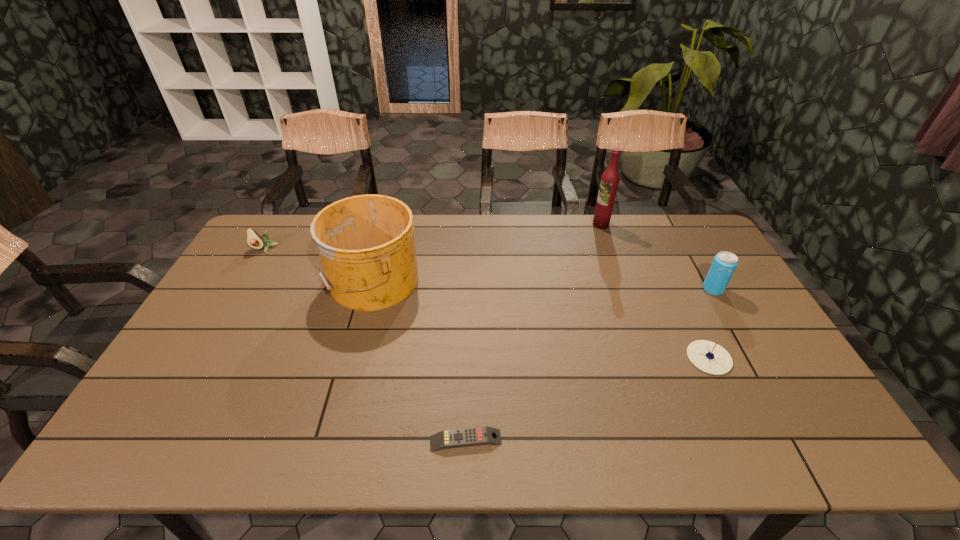
You are a GUI agent. You are given a task and a screenshot of the screen. Output one action in this format:
    pyautogui.click(x=<x>, y=<y>)
    Task: Click on the free space between the fourth shortest object and the fifth tallest object
    Image resolution: width=960 pixels, height=540 pixels.
    Given the screenshot: What is the action you would take?
    pyautogui.click(x=710, y=323)

Where is `vacant space in between the leftmost object and the second tallest object`? Image resolution: width=960 pixels, height=540 pixels. vacant space in between the leftmost object and the second tallest object is located at coordinates (318, 265).

Identify the location of free space between the rightmost object and the fifth object from left to right. The width and height of the screenshot is (960, 540). (710, 323).

Locate an element on the screen. The width and height of the screenshot is (960, 540). the fifth closest object to the rightmost object is located at coordinates (254, 240).

Find the location of `the fourth closest object to the shortest object`. the fourth closest object to the shortest object is located at coordinates (609, 183).

Image resolution: width=960 pixels, height=540 pixels. Find the location of `vacant space that satisfies the following two spatial constraints: 1. on the seed side of the third shortest object; 2. on the left side of the bucket`. vacant space that satisfies the following two spatial constraints: 1. on the seed side of the third shortest object; 2. on the left side of the bucket is located at coordinates (246, 280).

Where is `free location that satisfies the following two spatial constraints: 1. on the seed side of the third tallest object; 2. on the right side of the avocado`? This screenshot has width=960, height=540. free location that satisfies the following two spatial constraints: 1. on the seed side of the third tallest object; 2. on the right side of the avocado is located at coordinates (240, 289).

What are the coordinates of `vacant position in the image that satisfies the following two spatial constraints: 1. on the seed side of the third object from left to right; 2. on the left side of the leftmost object` in the screenshot? It's located at (153, 441).

You are a GUI agent. You are given a task and a screenshot of the screen. Output one action in this format:
    pyautogui.click(x=<x>, y=<y>)
    Task: Click on the vacant space that satisfies the following two spatial constraints: 1. on the label of the fourth object from left to right; 2. on the right side of the rightmost object
    The height and width of the screenshot is (540, 960).
    Given the screenshot: What is the action you would take?
    (623, 289)

Where is `vacant area that satisfies the following two spatial constraints: 1. on the label of the liquor; 2. on the left side of the fourth shortest object`? vacant area that satisfies the following two spatial constraints: 1. on the label of the liquor; 2. on the left side of the fourth shortest object is located at coordinates (623, 289).